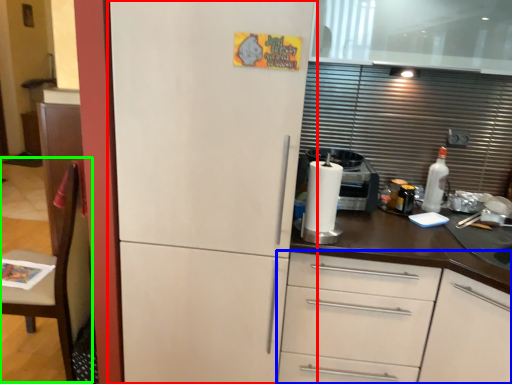
Question: Based on their relative distances, which object is farther from refrigerator (highlighted by a red box)? Choose from cabinetry (highlighted by a blue box) and chair (highlighted by a green box).

Choices:
 (A) cabinetry
 (B) chair

Answer: (B)